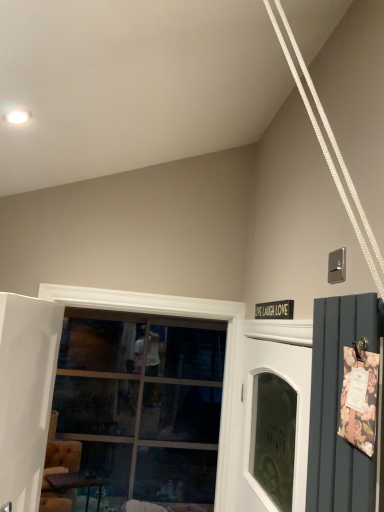
Question: Can you confirm if white glass door at center is smaller than white glossy door at left?

Choices:
 (A) no
 (B) yes

Answer: (A)

Question: Is white glass door at center to the right of white glossy door at left from the viewer's perspective?

Choices:
 (A) no
 (B) yes

Answer: (B)

Question: Is white glass door at center wider than white glossy door at left?

Choices:
 (A) yes
 (B) no

Answer: (A)

Question: Are white glass door at center and white glossy door at left far apart?

Choices:
 (A) yes
 (B) no

Answer: (B)

Question: Is white glass door at center further to camera compared to white glossy door at left?

Choices:
 (A) no
 (B) yes

Answer: (B)

Question: Is white glass door at center at the left side of white glossy door at left?

Choices:
 (A) no
 (B) yes

Answer: (A)

Question: Does wooden table at lower left contain white glossy door at left?

Choices:
 (A) no
 (B) yes

Answer: (A)

Question: Would you say wooden table at lower left is outside white glossy door at left?

Choices:
 (A) yes
 (B) no

Answer: (A)

Question: Is wooden table at lower left next to white glossy door at left?

Choices:
 (A) yes
 (B) no

Answer: (B)

Question: Is wooden table at lower left far away from white glossy door at left?

Choices:
 (A) no
 (B) yes

Answer: (B)

Question: From a real-world perspective, is wooden table at lower left over white glossy door at left?

Choices:
 (A) no
 (B) yes

Answer: (A)

Question: From a real-world perspective, is wooden table at lower left positioned under white glossy door at left based on gravity?

Choices:
 (A) yes
 (B) no

Answer: (A)

Question: Does white glass door at center come in front of wooden table at lower left?

Choices:
 (A) yes
 (B) no

Answer: (A)